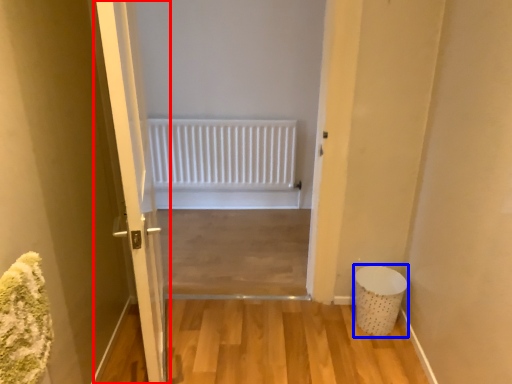
Question: Which point is closer to the camera, door (highlighted by a red box) or laundry basket (highlighted by a blue box)?

Choices:
 (A) door
 (B) laundry basket

Answer: (A)